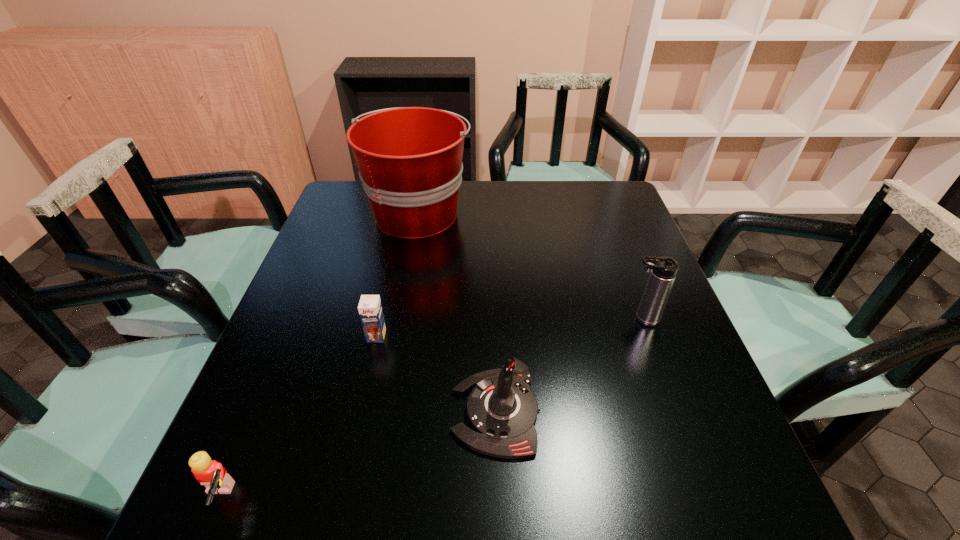
The image size is (960, 540). In order to click on free location located 0.150m on the handle side of the rightmost object in this screenshot , I will do `click(561, 319)`.

Identify the location of vacant space situated 0.270m on the handle side of the rightmost object. This screenshot has width=960, height=540. (509, 319).

Image resolution: width=960 pixels, height=540 pixels. What are the coordinates of `free space located on the handle side of the rightmost object` in the screenshot? It's located at (470, 319).

Find the location of `free space located 0.250m on the handle side of the joystick`. free space located 0.250m on the handle side of the joystick is located at coordinates (322, 412).

Identify the location of free spot located 0.220m on the handle side of the joystick. The height and width of the screenshot is (540, 960). (337, 412).

Locate an element on the screen. vacant space located on the handle side of the joystick is located at coordinates (290, 412).

Where is `free space located 0.170m on the front label of the third nearest object`? free space located 0.170m on the front label of the third nearest object is located at coordinates (360, 411).

Identify the location of vacant space located 0.270m in front of the nearest object with the accessory visible. (400, 499).

Locate an element on the screen. This screenshot has width=960, height=540. object present at the far edge is located at coordinates (410, 163).

Find the location of a particular element. The image size is (960, 540). object situated at the near edge is located at coordinates (210, 473).